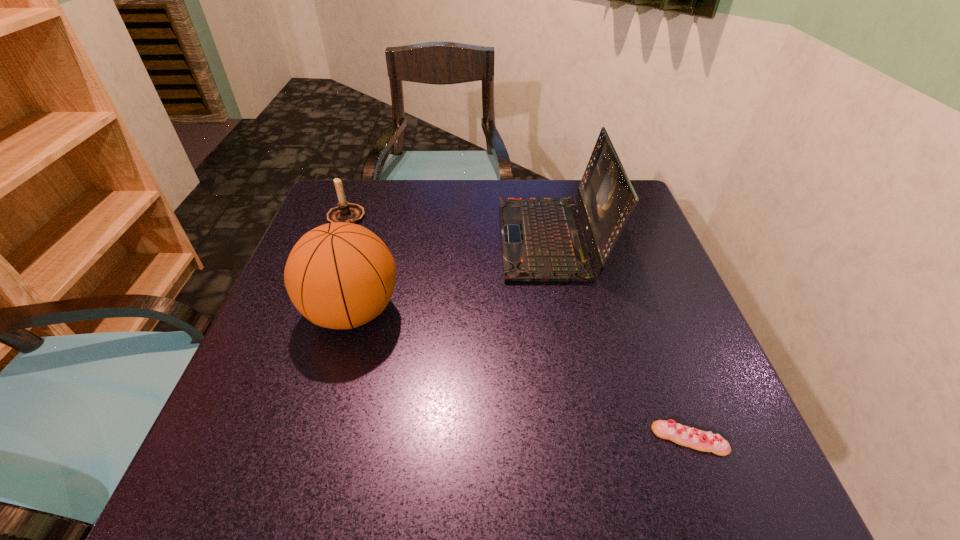
You are a GUI agent. You are given a task and a screenshot of the screen. Output one action in this format:
    pyautogui.click(x=<x>, y=<y>)
    Task: Click on the vacant region that satisfies the following two spatial constraints: 1. on the screen of the laptop computer; 2. on the left side of the eclair
    
    Given the screenshot: What is the action you would take?
    pyautogui.click(x=589, y=439)